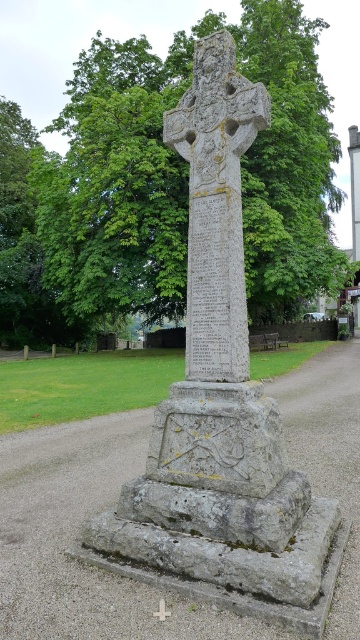
Question: Which point is closer to the camera?

Choices:
 (A) green leafy tree at center
 (B) granite cross at center

Answer: (B)

Question: Is granite cross at center below white stone cross at center?

Choices:
 (A) no
 (B) yes

Answer: (A)

Question: Among these points, which one is nearest to the camera?

Choices:
 (A) (205, 244)
 (B) (81, 296)

Answer: (A)

Question: Can you confirm if green leafy tree at center is smaller than white stone cross at center?

Choices:
 (A) yes
 (B) no

Answer: (B)

Question: Can you confirm if green leafy tree at center is bigger than white stone cross at center?

Choices:
 (A) yes
 (B) no

Answer: (A)

Question: Which object is positioned farthest from the white stone cross at center?

Choices:
 (A) granite cross at center
 (B) green leafy tree at center

Answer: (B)